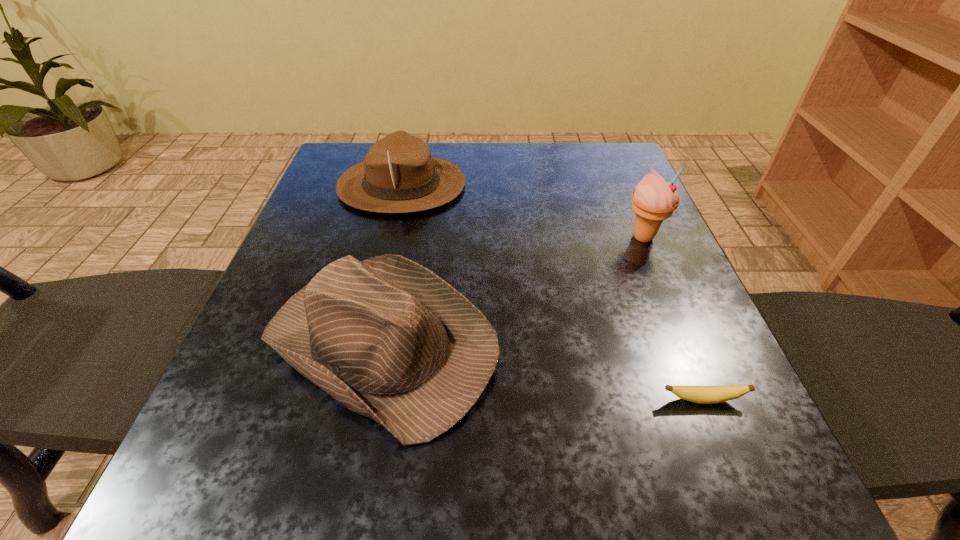
You are a GUI agent. You are given a task and a screenshot of the screen. Output one action in this format:
    pyautogui.click(x=<x>, y=<y>)
    Task: Click on the free space that satisfies the following two spatial constraints: 1. on the front side of the banana; 2. on the left side of the nearer fedora
    The image size is (960, 540).
    Given the screenshot: What is the action you would take?
    pyautogui.click(x=372, y=400)

You are a GUI agent. You are given a task and a screenshot of the screen. Output one action in this format:
    pyautogui.click(x=<x>, y=<y>)
    Task: Click on the vacant position in the image that satisfies the following two spatial constraints: 1. on the back side of the shortest object; 2. on the feather side of the farthest object
    The image size is (960, 540).
    Given the screenshot: What is the action you would take?
    pyautogui.click(x=616, y=185)